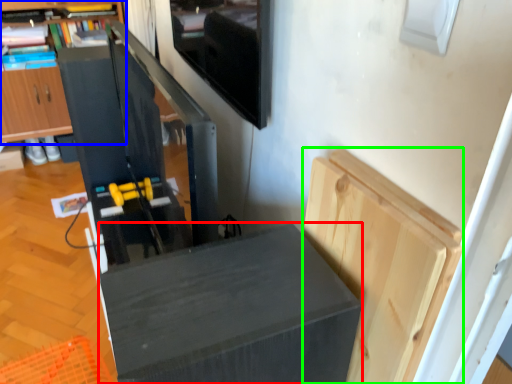
Question: Based on their relative distances, which object is farther from furniture (highlighted by a red box)? Choose from cabinetry (highlighted by a blue box) and cabinetry (highlighted by a green box).

Choices:
 (A) cabinetry
 (B) cabinetry

Answer: (A)